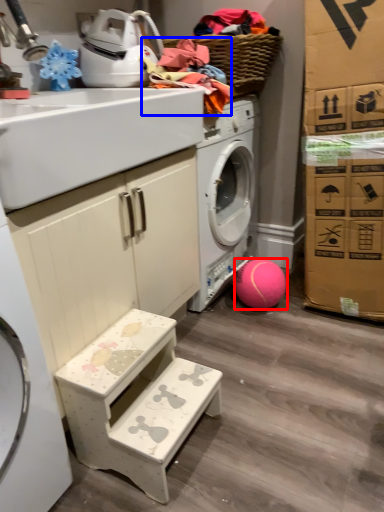
Question: Which object is further to the camera taking this photo, ball (highlighted by a red box) or clothing (highlighted by a blue box)?

Choices:
 (A) ball
 (B) clothing

Answer: (A)